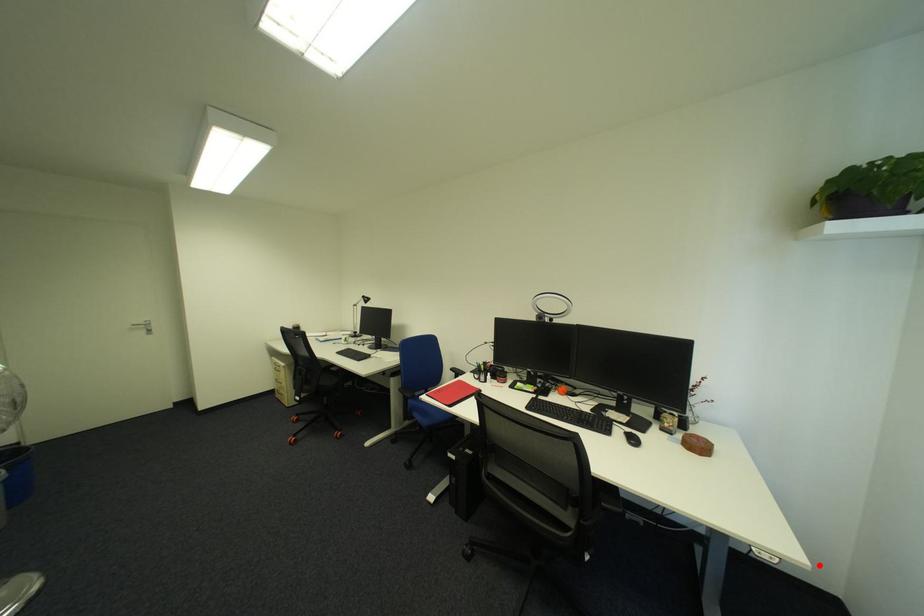
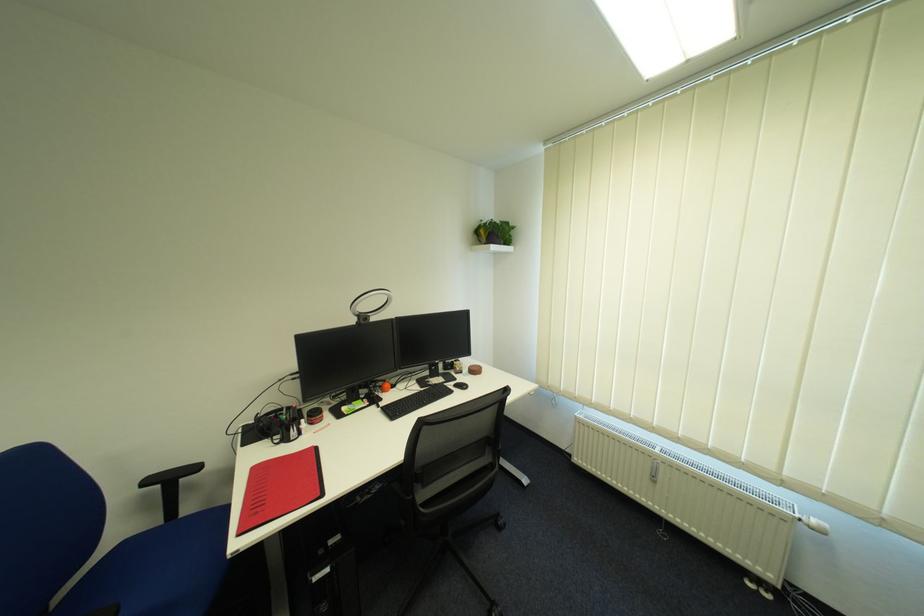
Where in the second image is the point corresponding to the highlighted location from the first image?

(548, 387)